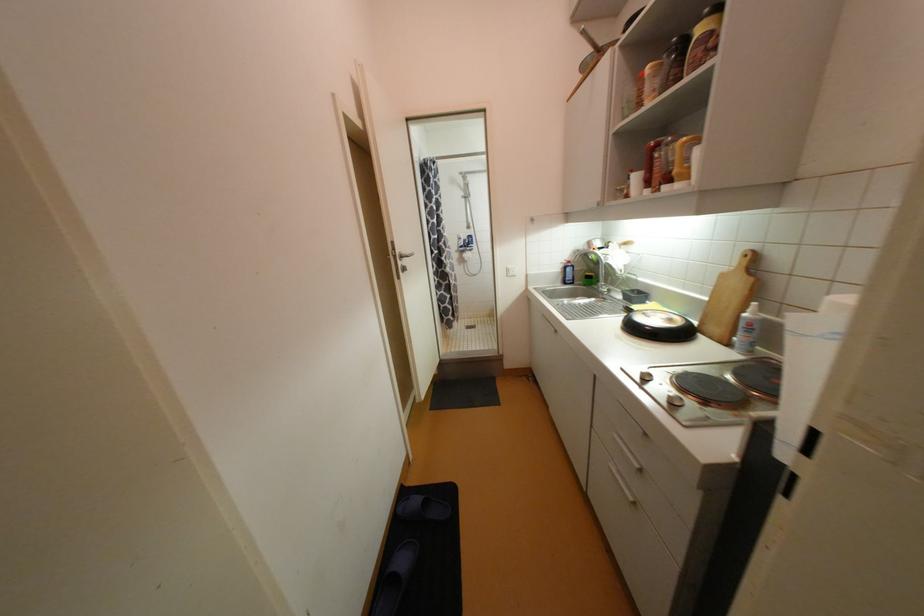
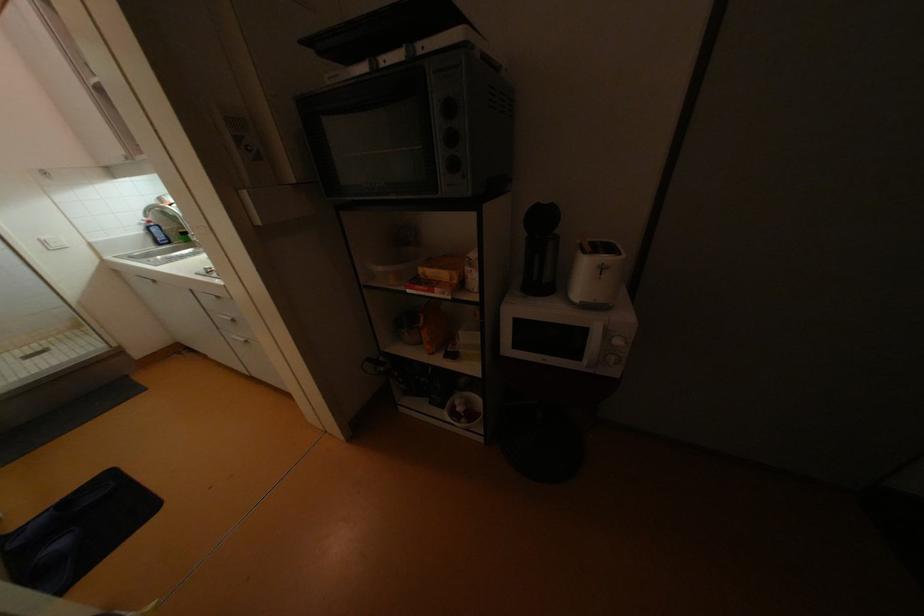
Where in the second image is the point corresponding to point 513,270 from the first image?

(49, 243)